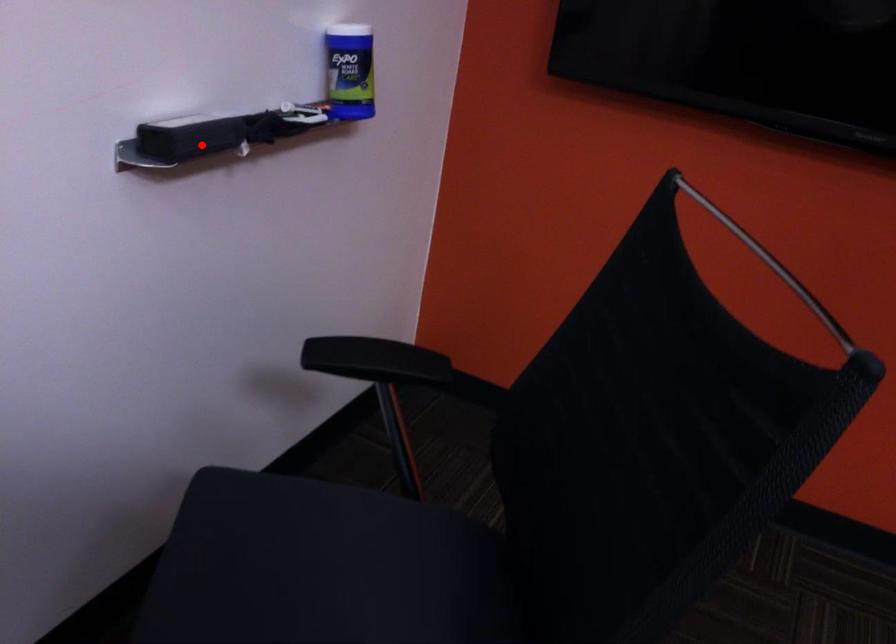
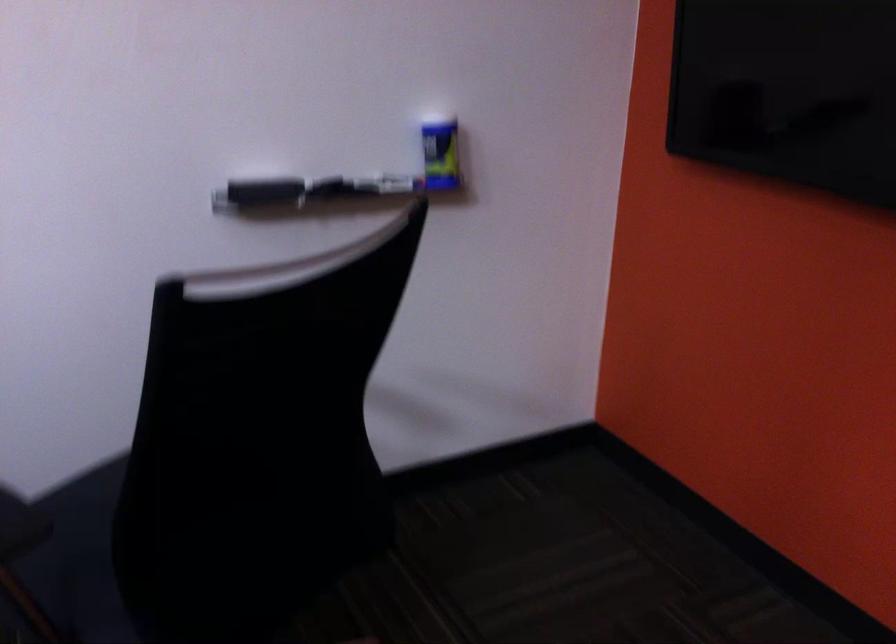
Question: I am providing you with two images of the same scene from different viewpoints. In image1, a red point is highlighted. Considering the same 3D point in image2, which of the following is correct?

Choices:
 (A) It is closer
 (B) It is farther

Answer: (B)